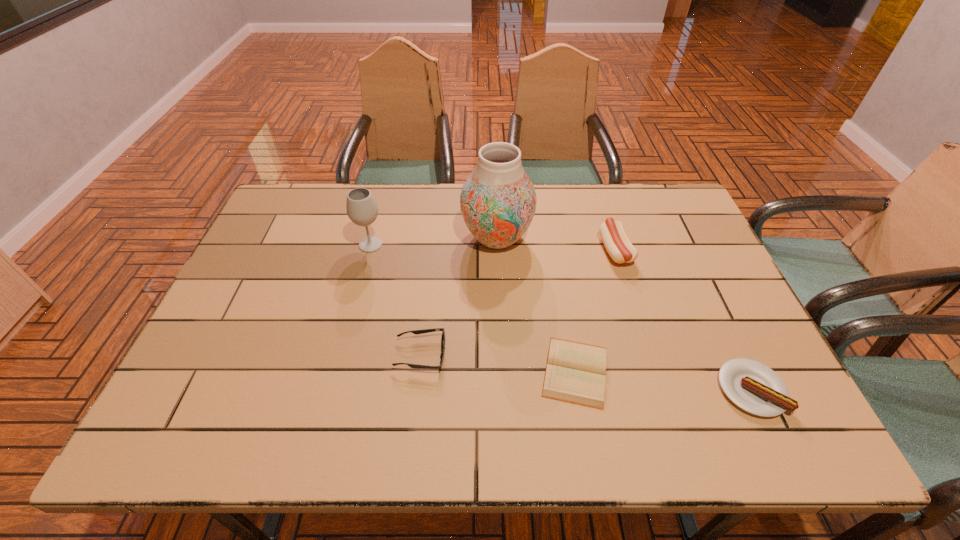
Identify the location of the tallest object. (498, 201).

Identify the location of the leftmost object. The image size is (960, 540). (362, 209).

You are a GUI agent. You are given a task and a screenshot of the screen. Output one action in this format:
    pyautogui.click(x=<x>, y=<y>)
    Task: Click on the wineglass
    Image resolution: width=960 pixels, height=540 pixels.
    Given the screenshot: What is the action you would take?
    pyautogui.click(x=362, y=209)

Locate an element on the screen. This screenshot has width=960, height=540. the third tallest object is located at coordinates (614, 237).

This screenshot has width=960, height=540. Find the location of `the farther sausage`. the farther sausage is located at coordinates (614, 237).

I want to click on the right sausage, so click(754, 387).

Image resolution: width=960 pixels, height=540 pixels. Find the location of `the rightmost object`. the rightmost object is located at coordinates (754, 387).

The height and width of the screenshot is (540, 960). Identify the location of the second object from left to right. (416, 332).

You are a GUI agent. You are given a task and a screenshot of the screen. Output one action in this format:
    pyautogui.click(x=<x>, y=<y>)
    Task: Click on the shortest object
    The height and width of the screenshot is (540, 960).
    Given the screenshot: What is the action you would take?
    pyautogui.click(x=575, y=372)

Where is `free space located on the front of the vase`? free space located on the front of the vase is located at coordinates (501, 348).